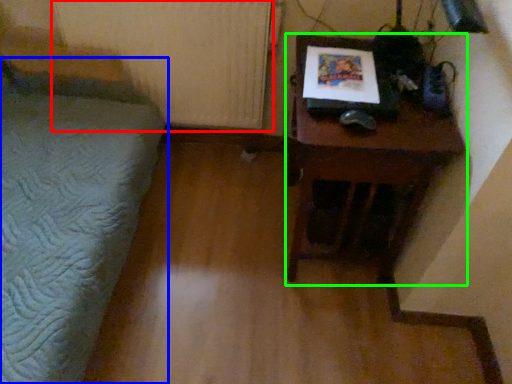
Question: Which is farther away from radiator (highlighted by a red box)? furniture (highlighted by a blue box) or table (highlighted by a green box)?

Choices:
 (A) furniture
 (B) table

Answer: (B)